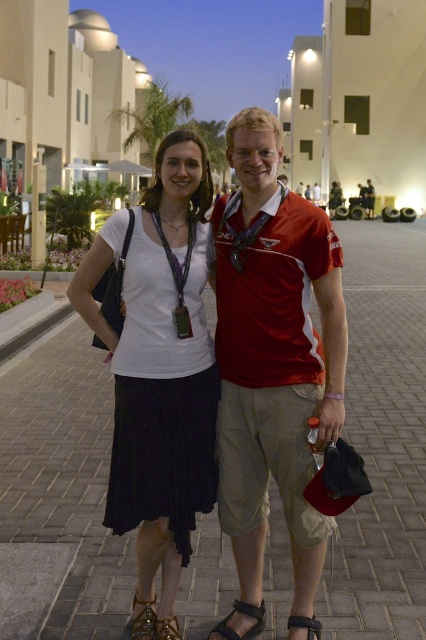
You are standing at the point marked as point (382,440) in the image. What type of surface are you currently standing on?

You are standing on brick pavement at center.

You are a photographer setting up a shot of the two people in the scene. You need to ensure that the red fabric shirt at center and the black leather sandal at lower center are both in focus. Which object should you focus on first to ensure both are sharp?

The red fabric shirt at center is above the black leather sandal at lower center, so you should focus on the red fabric shirt at center first to ensure both are in focus.